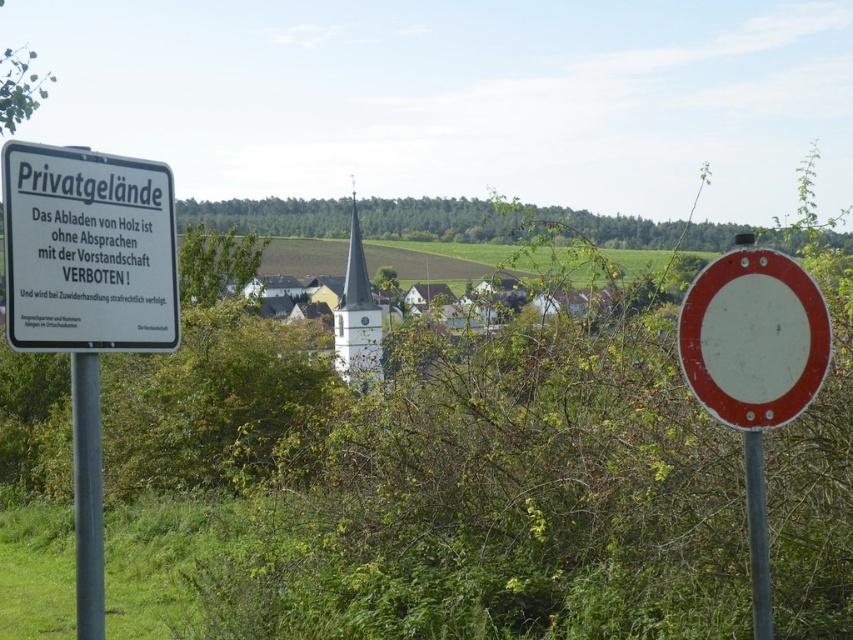
Looking at this image, can you confirm if white plastic sign at upper left is smaller than white matte circle at center?

No.

Can you confirm if white plastic sign at upper left is positioned to the right of white matte circle at center?

In fact, white plastic sign at upper left is to the left of white matte circle at center.

Is point (90, 218) positioned behind point (796, 385)?

No, it is not.

The image size is (853, 640). Identify the location of white plastic sign at upper left. (88, 250).

Is point (747, 364) positioned before point (97, 384)?

Yes, it is.

Can you confirm if white matte circle at center is shorter than metallic pole at left?

Yes.

What do you see at coordinates (753, 339) in the screenshot?
I see `white matte circle at center` at bounding box center [753, 339].

Locate an element on the screen. This screenshot has height=640, width=853. white matte circle at center is located at coordinates (753, 339).

Can you confirm if metallic pole at left is taller than metallic pole at center?

Correct, metallic pole at left is much taller as metallic pole at center.

Does point (84, 356) lie in front of point (757, 532)?

No, (84, 356) is behind (757, 532).

Where is `metallic pole at left`? metallic pole at left is located at coordinates (86, 496).